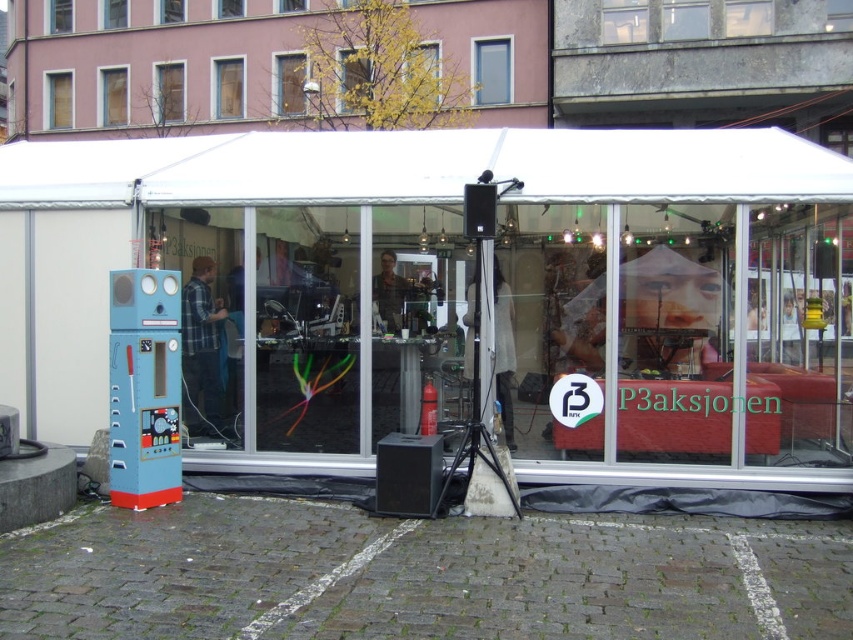
You are planning to install a new lighting system for the event. The white fabric canopy at upper center and the blue painted metal vending machine at left are in the way of the installation path. Which object should you adjust first to ensure the lighting equipment can pass through?

The white fabric canopy at upper center is bigger than the blue painted metal vending machine at left, so you should adjust the white fabric canopy at upper center first to accommodate the lighting equipment.

You are planning to hang a banner from the highest point in the area. Which object should you choose between the white fabric canopy at upper center and the blue painted metal vending machine at left?

The white fabric canopy at upper center has a greater height compared to the blue painted metal vending machine at left, so you should hang the banner from the white fabric canopy at upper center.

You are standing at the entrance of the tent and looking towards the center. Where is the white fabric canopy at upper center located in relation to your position?

The white fabric canopy at upper center is located at point (425, 168) relative to your position.